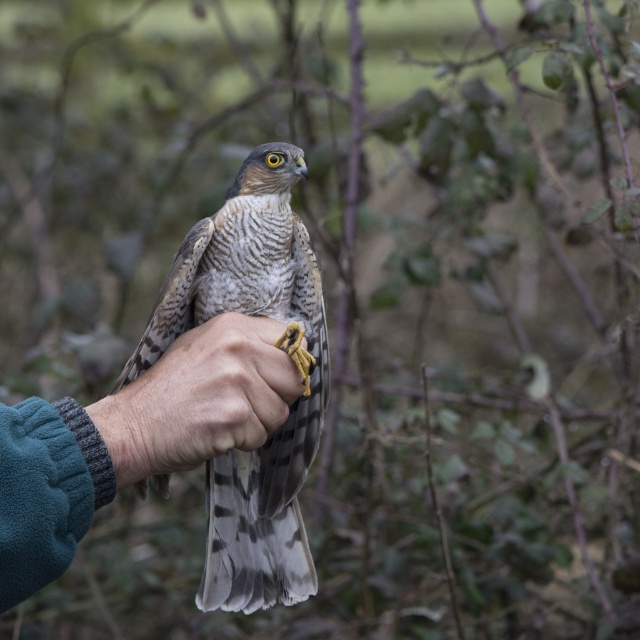
Is teal fleece arm at center below smooth leather glove at center?

Indeed, teal fleece arm at center is positioned under smooth leather glove at center.

Is teal fleece arm at center thinner than smooth leather glove at center?

Incorrect, teal fleece arm at center's width is not less than smooth leather glove at center's.

Identify the location of teal fleece arm at center. (132, 438).

Can you confirm if speckled feathered falcon at center is smaller than teal fleece arm at center?

No.

Does point (246, 595) come closer to viewer compared to point (230, 440)?

No, (246, 595) is behind (230, 440).

Is point (227, 608) behind point (148, 422)?

Yes.

At what (x,y) coordinates should I click in order to perform the action: click on speckled feathered falcon at center. Please return your answer as a coordinate pair (x, y). Looking at the image, I should click on (291, 406).

Between speckled feathered falcon at center and smooth leather glove at center, which one has more height?

With more height is speckled feathered falcon at center.

Does speckled feathered falcon at center come behind smooth leather glove at center?

Yes, it is.

What do you see at coordinates (291, 406) in the screenshot?
I see `speckled feathered falcon at center` at bounding box center [291, 406].

Where is `speckled feathered falcon at center`? Image resolution: width=640 pixels, height=640 pixels. speckled feathered falcon at center is located at coordinates (x=291, y=406).